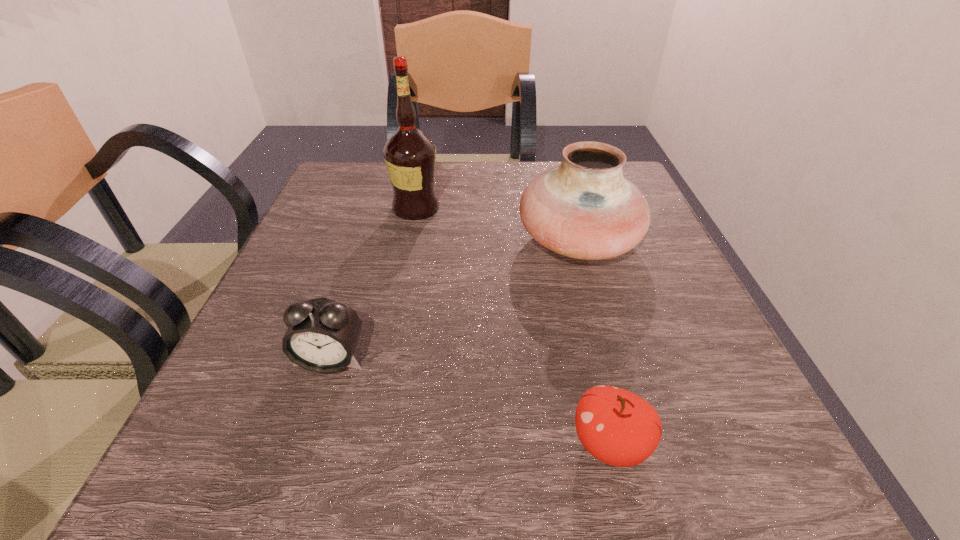
Locate an element on the screen. vacant space that satisfies the following two spatial constraints: 1. on the front side of the third farthest object; 2. on the right side of the apple is located at coordinates [x=303, y=444].

The image size is (960, 540). What are the coordinates of `vacant space that satisfies the following two spatial constraints: 1. on the front side of the apple; 2. on the left side of the third farthest object` in the screenshot? It's located at (303, 444).

Find the location of a particular element. free region that satisfies the following two spatial constraints: 1. on the back side of the third shortest object; 2. on the right side of the nearest object is located at coordinates (562, 241).

Where is `free space that satisfies the following two spatial constraints: 1. on the label of the alcohol; 2. on the front side of the third farthest object`? This screenshot has width=960, height=540. free space that satisfies the following two spatial constraints: 1. on the label of the alcohol; 2. on the front side of the third farthest object is located at coordinates (385, 360).